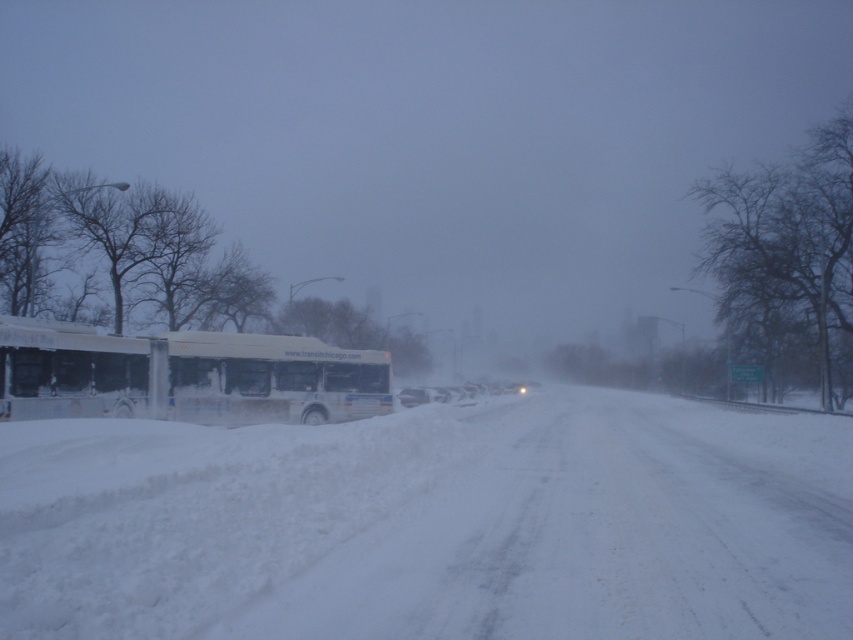
Is white fluffy snow at center taller than white matte bus at left?

No, white fluffy snow at center is not taller than white matte bus at left.

Which is more to the left, white fluffy snow at center or white matte bus at left?

Positioned to the left is white matte bus at left.

Describe the element at coordinates (433, 524) in the screenshot. I see `white fluffy snow at center` at that location.

Image resolution: width=853 pixels, height=640 pixels. In order to click on white fluffy snow at center in this screenshot , I will do `click(433, 524)`.